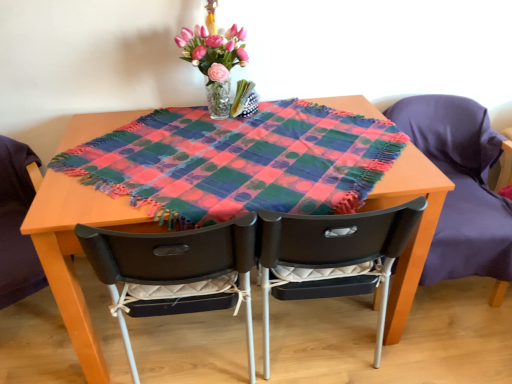
Question: Does black plastic chair at center, the 2th chair positioned from the right, have a smaller size compared to wooden table at center?

Choices:
 (A) yes
 (B) no

Answer: (B)

Question: Can you confirm if black plastic chair at center, the second chair viewed from the left, is positioned to the left of wooden table at center?

Choices:
 (A) yes
 (B) no

Answer: (B)

Question: Can you confirm if black plastic chair at center, the second chair viewed from the left, is shorter than wooden table at center?

Choices:
 (A) no
 (B) yes

Answer: (A)

Question: Is black plastic chair at center, the second chair viewed from the left, turned away from wooden table at center?

Choices:
 (A) yes
 (B) no

Answer: (B)

Question: Are black plastic chair at center, the second chair viewed from the left, and wooden table at center far apart?

Choices:
 (A) no
 (B) yes

Answer: (A)

Question: Is black plastic chair at center, the 2th chair positioned from the right, inside the boundaries of matte black chair at center, the third chair viewed from the right, or outside?

Choices:
 (A) inside
 (B) outside

Answer: (B)

Question: Looking at their shapes, would you say black plastic chair at center, the 2th chair positioned from the right, is wider or thinner than matte black chair at center, the third chair viewed from the right?

Choices:
 (A) thin
 (B) wide

Answer: (B)

Question: Considering the positions of black plastic chair at center, the 2th chair positioned from the right, and matte black chair at center, the 1th chair viewed from the left, in the image, is black plastic chair at center, the 2th chair positioned from the right, bigger or smaller than matte black chair at center, the 1th chair viewed from the left,?

Choices:
 (A) big
 (B) small

Answer: (B)

Question: From the image's perspective, is black plastic chair at center, the 2th chair positioned from the right, above or below matte black chair at center, the third chair viewed from the right?

Choices:
 (A) above
 (B) below

Answer: (A)

Question: Is translucent glass vase at upper center in front of or behind matte black chair at right, which is the first chair from right to left, in the image?

Choices:
 (A) front
 (B) behind

Answer: (A)

Question: Does point (214, 59) appear closer or farther from the camera than point (487, 134)?

Choices:
 (A) farther
 (B) closer

Answer: (B)

Question: In terms of size, does translucent glass vase at upper center appear bigger or smaller than matte black chair at right, which is the first chair from right to left?

Choices:
 (A) big
 (B) small

Answer: (B)

Question: Considering the relative positions of translucent glass vase at upper center and matte black chair at right, which is the 3th chair in left-to-right order, in the image provided, is translucent glass vase at upper center to the left or to the right of matte black chair at right, which is the 3th chair in left-to-right order,?

Choices:
 (A) right
 (B) left

Answer: (B)

Question: From the image's perspective, relative to black plastic chair at center, the 2th chair positioned from the right, is matte black chair at right, which is the 3th chair in left-to-right order, above or below?

Choices:
 (A) below
 (B) above

Answer: (B)

Question: In terms of width, does matte black chair at right, which is the 3th chair in left-to-right order, look wider or thinner when compared to black plastic chair at center, the 2th chair positioned from the right?

Choices:
 (A) wide
 (B) thin

Answer: (A)